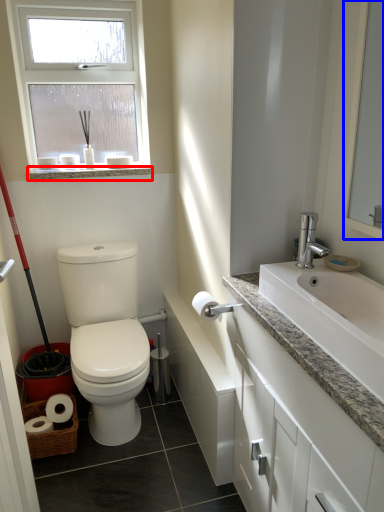
Question: Which point is closer to the camera, window sill (highlighted by a red box) or mirror (highlighted by a blue box)?

Choices:
 (A) window sill
 (B) mirror

Answer: (B)